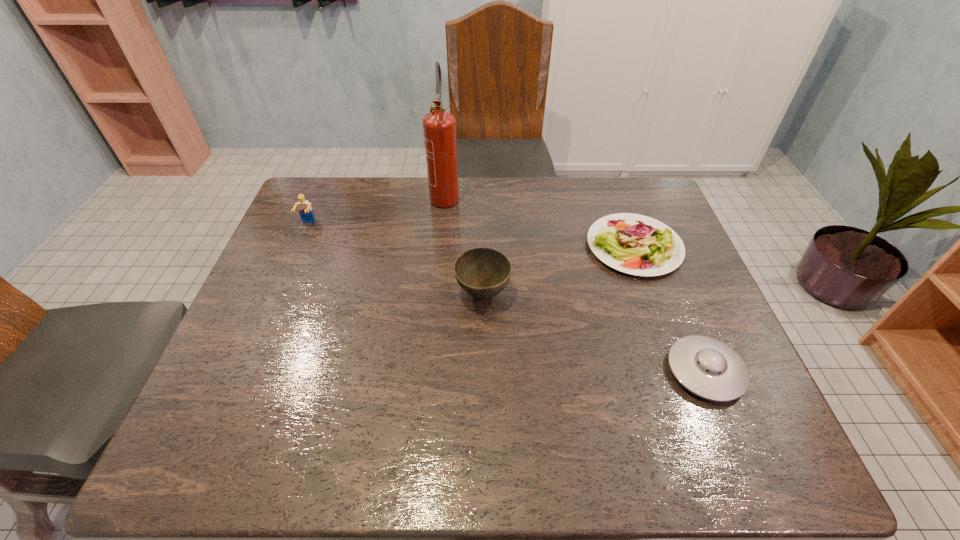
Locate an element on the screen. The image size is (960, 540). fire extinguisher is located at coordinates (439, 127).

Image resolution: width=960 pixels, height=540 pixels. In order to click on the farthest object in this screenshot , I will do (x=439, y=127).

Find the location of a particular element. This screenshot has height=540, width=960. the third object from right to left is located at coordinates (483, 273).

The image size is (960, 540). What are the coordinates of `Lego` in the screenshot? It's located at (305, 210).

I want to click on salad plate, so click(635, 244).

This screenshot has width=960, height=540. What are the coordinates of `saucer` in the screenshot? It's located at (708, 368).

Where is `free space located from the nozzle of the fire extinguisher`? Image resolution: width=960 pixels, height=540 pixels. free space located from the nozzle of the fire extinguisher is located at coordinates point(442,227).

Where is `vacant space located on the front of the bowl`? This screenshot has height=540, width=960. vacant space located on the front of the bowl is located at coordinates (484, 443).

I want to click on vacant region located 0.370m on the face of the leftmost object, so click(x=263, y=329).

Locate an element on the screen. blank area located on the front of the salad plate is located at coordinates (670, 347).